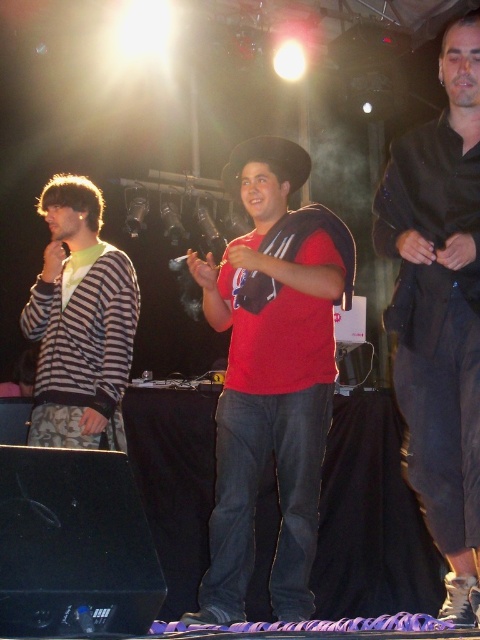
You are a photographer at the event and want to capture both the black satin suit at right and the striped knit cardigan at left in a single frame. Based on their sizes, which one should you focus on first to ensure both fit in the shot?

The black satin suit at right has a lesser width compared to the striped knit cardigan at left. To ensure both fit in the shot, focus on positioning the striped knit cardigan at left first since it is wider and requires more space in the frame.

You are standing in the crowd at the music event and want to take a photo of both point (286,524) and point (397,221) in the image. Which point is closer to you so you can focus your camera first?

Point (286,524) is further to the viewer than point (397,221). Therefore, to focus your camera first on the closer point, you should start with point (397,221) since it is nearer to you.